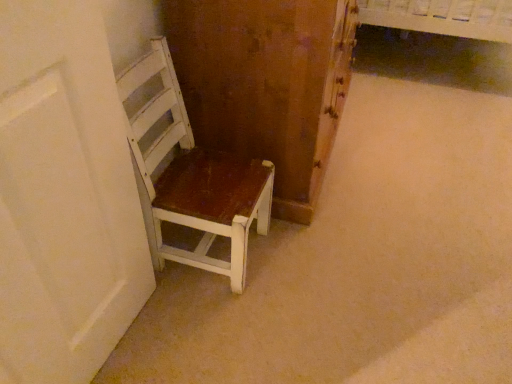
Question: Should I look upward or downward to see white painted wood chair at left?

Choices:
 (A) down
 (B) up

Answer: (B)